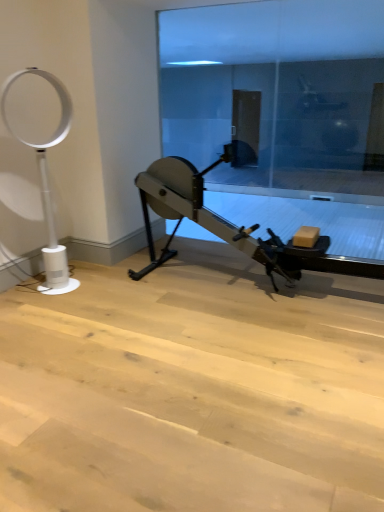
What do you see at coordinates (283, 113) in the screenshot? I see `transparent glass door at center` at bounding box center [283, 113].

This screenshot has width=384, height=512. What do you see at coordinates (47, 180) in the screenshot? I see `white plastic fan at left` at bounding box center [47, 180].

I want to click on metallic gray stationary bicycle at center, so click(x=230, y=225).

From a real-world perspective, between transparent glass door at center and white plastic fan at left, who is vertically lower?

white plastic fan at left is physically lower.

From the image's perspective, is transparent glass door at center positioned above or below white plastic fan at left?

transparent glass door at center is situated higher than white plastic fan at left in the image.

In the scene shown: Which is more to the right, transparent glass door at center or white plastic fan at left?

Positioned to the right is transparent glass door at center.

From the picture: Is transparent glass door at center not within white plastic fan at left?

Yes, transparent glass door at center is not within white plastic fan at left.

How distant is white plastic fan at left from transparent glass door at center?

They are 3.55 meters apart.

Which of these two, white plastic fan at left or transparent glass door at center, stands shorter?

white plastic fan at left is shorter.

Considering the relative sizes of white plastic fan at left and transparent glass door at center in the image provided, is white plastic fan at left smaller than transparent glass door at center?

No, white plastic fan at left is not smaller than transparent glass door at center.

Is white plastic fan at left facing towards transparent glass door at center?

No, white plastic fan at left is not oriented towards transparent glass door at center.

Does white plastic fan at left appear on the left side of metallic gray stationary bicycle at center?

Indeed, white plastic fan at left is positioned on the left side of metallic gray stationary bicycle at center.

Is white plastic fan at left positioned before metallic gray stationary bicycle at center?

No, it is behind metallic gray stationary bicycle at center.

Based on the photo, would you say white plastic fan at left is inside or outside metallic gray stationary bicycle at center?

white plastic fan at left is not inside metallic gray stationary bicycle at center, it's outside.

From the image's perspective, which is below, white plastic fan at left or metallic gray stationary bicycle at center?

metallic gray stationary bicycle at center, from the image's perspective.

From the image's perspective, is metallic gray stationary bicycle at center beneath white plastic fan at left?

Correct, metallic gray stationary bicycle at center appears lower than white plastic fan at left in the image.

In the scene shown: Is metallic gray stationary bicycle at center next to white plastic fan at left and touching it?

There is a gap between metallic gray stationary bicycle at center and white plastic fan at left.

Consider the image. Could white plastic fan at left be considered to be inside metallic gray stationary bicycle at center?

No, metallic gray stationary bicycle at center does not contain white plastic fan at left.

Are transparent glass door at center and metallic gray stationary bicycle at center located far from each other?

transparent glass door at center is far away from metallic gray stationary bicycle at center.

Which is closer to the camera, (299, 63) or (160, 179)?

Point (299, 63) is farther from the camera than point (160, 179).

At what (x,y) coordinates should I click in order to perform the action: click on stationary bicycle that is on the left side of transparent glass door at center. Please return your answer as a coordinate pair (x, y). The image size is (384, 512). Looking at the image, I should click on (230, 225).

Considering the positions of objects transparent glass door at center and metallic gray stationary bicycle at center in the image provided, who is behind, transparent glass door at center or metallic gray stationary bicycle at center?

transparent glass door at center is further from the camera.

Find the location of a particular element. This screenshot has height=512, width=384. stationary bicycle in front of the transparent glass door at center is located at coordinates (230, 225).

Can you see metallic gray stationary bicycle at center touching transparent glass door at center?

No, metallic gray stationary bicycle at center is not beside transparent glass door at center.

Is metallic gray stationary bicycle at center bigger or smaller than transparent glass door at center?

Clearly, metallic gray stationary bicycle at center is larger in size than transparent glass door at center.

Which object is positioned more to the left, metallic gray stationary bicycle at center or transparent glass door at center?

From the viewer's perspective, metallic gray stationary bicycle at center appears more on the left side.

The height and width of the screenshot is (512, 384). In the image, there is a white plastic fan at left. Identify the location of glass door above it (from the image's perspective). (283, 113).

Find the location of a particular element. basketball hoop in front of the transparent glass door at center is located at coordinates point(47,180).

Based on their spatial positions, is white plastic fan at left or metallic gray stationary bicycle at center closer to transparent glass door at center?

metallic gray stationary bicycle at center is positioned closer to the anchor transparent glass door at center.

Consider the image. Looking at the image, which one is located further to transparent glass door at center, metallic gray stationary bicycle at center or white plastic fan at left?

white plastic fan at left lies further to transparent glass door at center than the other object.

From the image, which object appears to be farther from metallic gray stationary bicycle at center, white plastic fan at left or transparent glass door at center?

transparent glass door at center lies further to metallic gray stationary bicycle at center than the other object.

From the image, which object appears to be nearer to white plastic fan at left, metallic gray stationary bicycle at center or transparent glass door at center?

metallic gray stationary bicycle at center lies closer to white plastic fan at left than the other object.

Based on their spatial positions, is transparent glass door at center or metallic gray stationary bicycle at center further from white plastic fan at left?

transparent glass door at center lies further to white plastic fan at left than the other object.

From the image, which object appears to be farther from metallic gray stationary bicycle at center, transparent glass door at center or white plastic fan at left?

transparent glass door at center is further to metallic gray stationary bicycle at center.

Identify the location of stationary bicycle between white plastic fan at left and transparent glass door at center. This screenshot has height=512, width=384. pyautogui.click(x=230, y=225).